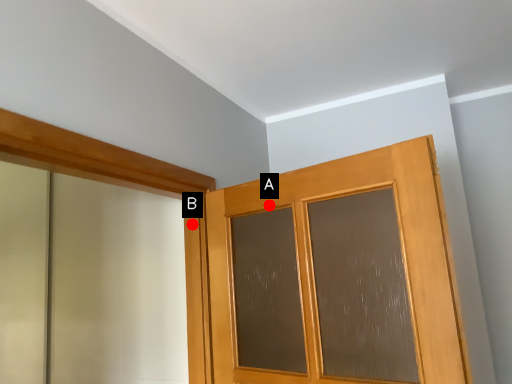
Question: Two points are circled on the image, labeled by A and B beside each circle. Which point is farther from the camera taking this photo?

Choices:
 (A) A is further
 (B) B is further

Answer: (B)